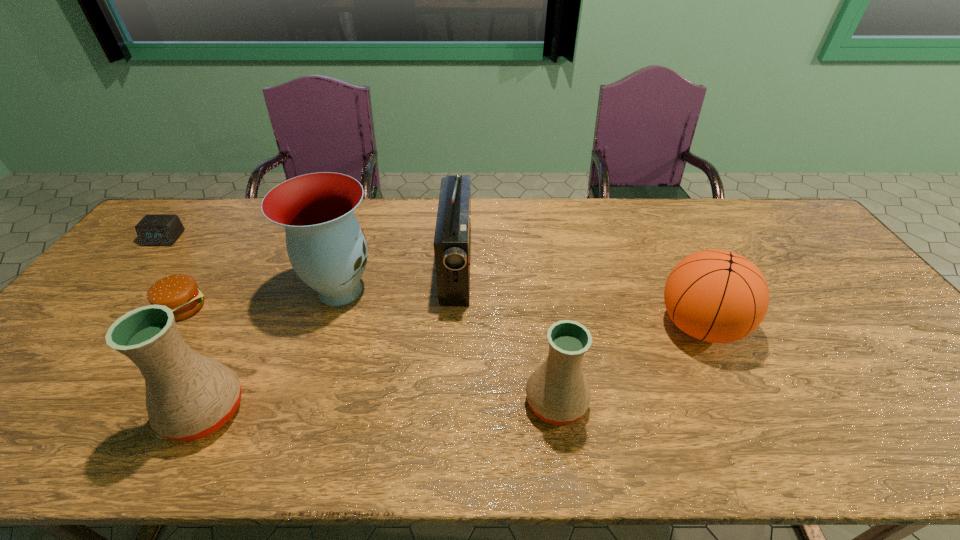
Please point a free position for a pottery on the right. Please provide its 2D coordinates. Your answer should be formatted as a tuple, i.e. [(x, y)], where the tuple contains the x and y coordinates of a point satisfying the conditions above.

[(895, 393)]